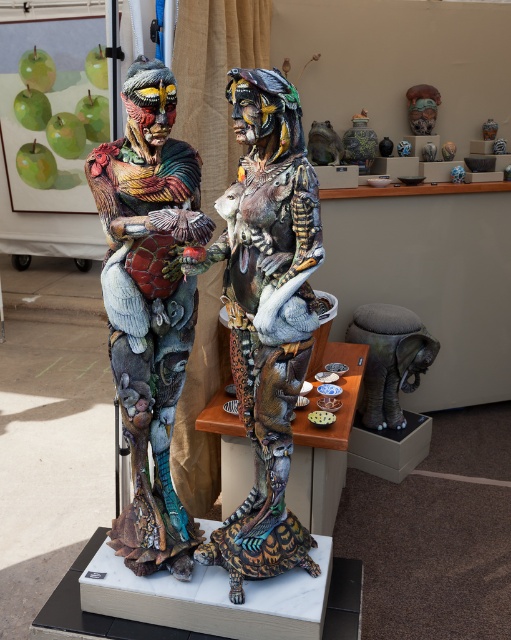
Can you confirm if multicolored painted figure at center is positioned above multicolored painted sculpture at center?

Actually, multicolored painted figure at center is below multicolored painted sculpture at center.

Find the location of `multicolored painted figure at center`. multicolored painted figure at center is located at coordinates (266, 316).

Image resolution: width=511 pixels, height=640 pixels. I want to click on multicolored painted figure at center, so click(266, 316).

Identify the location of multicolored painted figure at center. (266, 316).

Can you confirm if multicolored painted figure at center is thinner than brown leather stool at lower right?

Yes, multicolored painted figure at center is thinner than brown leather stool at lower right.

Who is more distant from viewer, (x=269, y=241) or (x=363, y=339)?

Point (x=363, y=339)

Where is `multicolored painted figure at center`? The width and height of the screenshot is (511, 640). multicolored painted figure at center is located at coordinates (266, 316).

Where is `multicolored painted figure at center`? Image resolution: width=511 pixels, height=640 pixels. multicolored painted figure at center is located at coordinates (266, 316).

Is multicolored painted sculpture at center smaller than brown leather stool at lower right?

No.

How much distance is there between multicolored painted sculpture at center and brown leather stool at lower right?

multicolored painted sculpture at center is 5.57 feet from brown leather stool at lower right.

I want to click on multicolored painted sculpture at center, so click(150, 305).